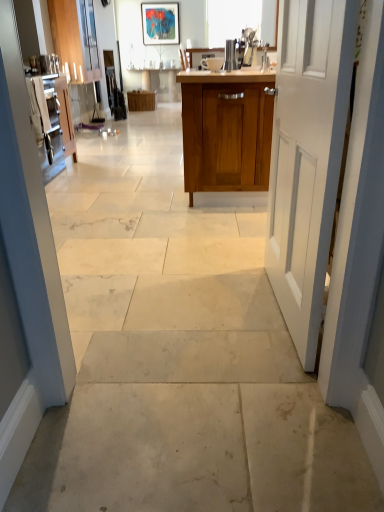
Find the location of `vacant space in white matte door at right (from a real-world perspective)`. vacant space in white matte door at right (from a real-world perspective) is located at coordinates (276, 315).